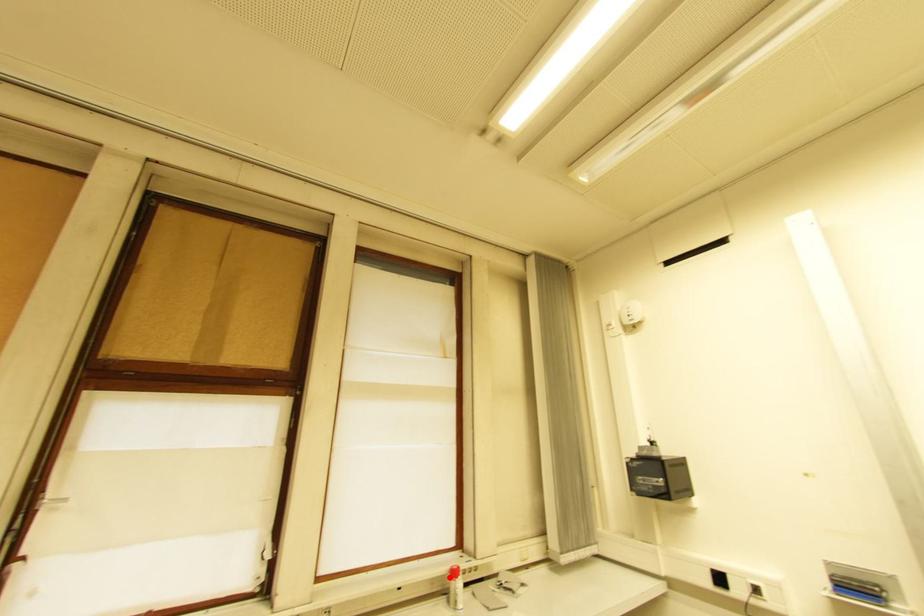
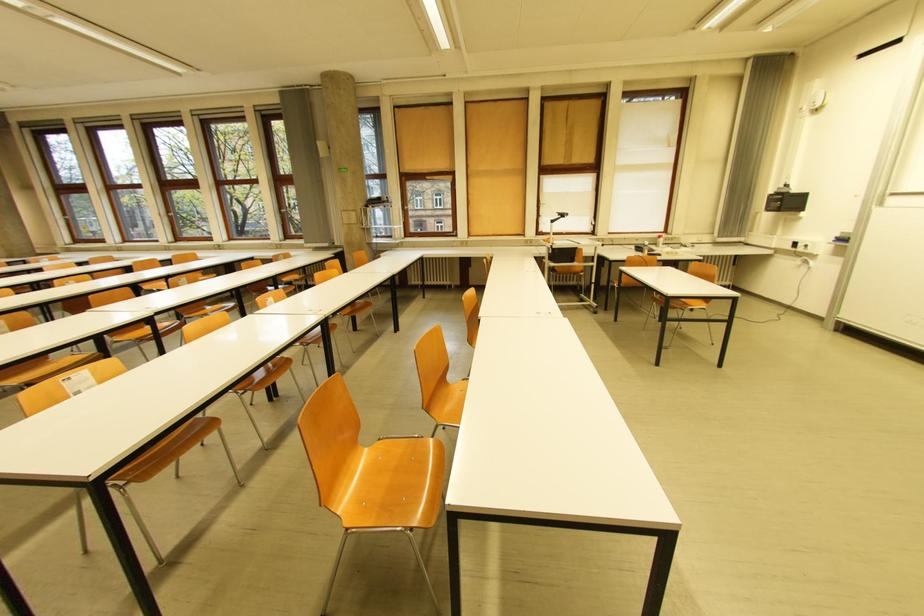
Question: A red point is marked in image1. In image2, is the corresponding 3D point closer to the camera or farther? Reply with the corresponding letter.

Choices:
 (A) The corresponding 3D point is closer.
 (B) The corresponding 3D point is farther.

Answer: (A)